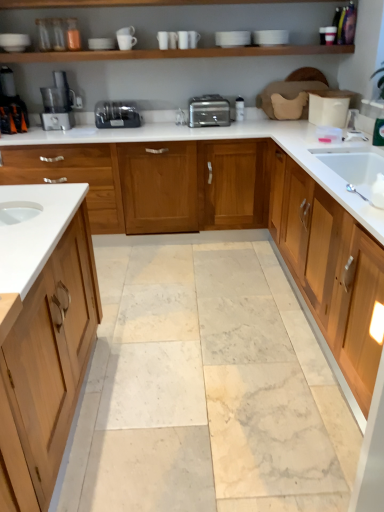
At what (x,y) coordinates should I click in order to perform the action: click on free space above marble tile floor at center (from a real-world perspective). Please return your answer as a coordinate pair (x, y). Looking at the image, I should click on (195, 320).